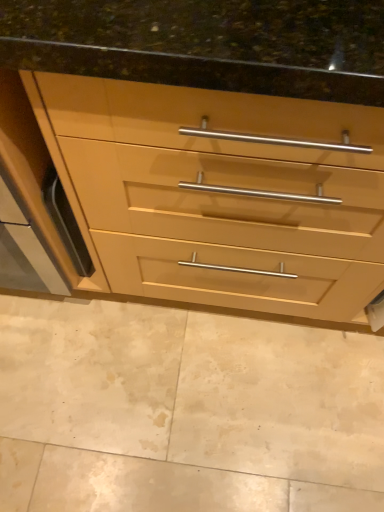
This screenshot has height=512, width=384. Identify the location of matte wood chest of drawers at center. (216, 145).

What do you see at coordinates (216, 145) in the screenshot?
I see `matte wood chest of drawers at center` at bounding box center [216, 145].

Locate an element on the screen. The image size is (384, 512). beige marble floor at lower center is located at coordinates (185, 410).

What do you see at coordinates (185, 410) in the screenshot? I see `beige marble floor at lower center` at bounding box center [185, 410].

Identify the location of matte wood chest of drawers at center. The image size is (384, 512). (216, 145).

Looking at this image, between beige marble floor at lower center and matte wood chest of drawers at center, which one appears on the left side from the viewer's perspective?

From the viewer's perspective, beige marble floor at lower center appears more on the left side.

Is beige marble floor at lower center closer to the viewer compared to matte wood chest of drawers at center?

No.

Is point (17, 426) closer or farther from the camera than point (304, 206)?

Clearly, point (17, 426) is more distant from the camera than point (304, 206).

From the image's perspective, which is above, beige marble floor at lower center or matte wood chest of drawers at center?

matte wood chest of drawers at center, from the image's perspective.

From a real-world perspective, between beige marble floor at lower center and matte wood chest of drawers at center, who is vertically lower?

beige marble floor at lower center is physically lower.

Considering the sizes of objects beige marble floor at lower center and matte wood chest of drawers at center in the image provided, who is thinner, beige marble floor at lower center or matte wood chest of drawers at center?

matte wood chest of drawers at center.

Is beige marble floor at lower center shorter than matte wood chest of drawers at center?

Yes.

Is beige marble floor at lower center smaller than matte wood chest of drawers at center?

Yes.

Is beige marble floor at lower center inside the boundaries of matte wood chest of drawers at center, or outside?

beige marble floor at lower center lies outside matte wood chest of drawers at center.

Is there a large distance between beige marble floor at lower center and matte wood chest of drawers at center?

No, beige marble floor at lower center is in close proximity to matte wood chest of drawers at center.

Is beige marble floor at lower center turned away from matte wood chest of drawers at center?

No, matte wood chest of drawers at center is not at the back of beige marble floor at lower center.

Identify the location of the chest of drawers that appears above the beige marble floor at lower center (from the image's perspective). This screenshot has width=384, height=512. (216, 145).

Based on their positions, is matte wood chest of drawers at center located to the left or right of beige marble floor at lower center?

matte wood chest of drawers at center is to the right of beige marble floor at lower center.

Is matte wood chest of drawers at center behind beige marble floor at lower center?

No, it is not.

Which point is more forward, (134, 260) or (336, 508)?

The point (134, 260) is more forward.

From the image's perspective, which one is positioned higher, matte wood chest of drawers at center or beige marble floor at lower center?

matte wood chest of drawers at center is shown above in the image.

From a real-world perspective, who is located higher, matte wood chest of drawers at center or beige marble floor at lower center?

From a 3D spatial view, matte wood chest of drawers at center is above.

Which of these two, matte wood chest of drawers at center or beige marble floor at lower center, is thinner?

Thinner between the two is matte wood chest of drawers at center.

Between matte wood chest of drawers at center and beige marble floor at lower center, which one has more height?

With more height is matte wood chest of drawers at center.

Who is bigger, matte wood chest of drawers at center or beige marble floor at lower center?

With larger size is matte wood chest of drawers at center.

Can we say matte wood chest of drawers at center lies outside beige marble floor at lower center?

Indeed, matte wood chest of drawers at center is completely outside beige marble floor at lower center.

Is there a large distance between matte wood chest of drawers at center and beige marble floor at lower center?

No, matte wood chest of drawers at center is not far from beige marble floor at lower center.

Is matte wood chest of drawers at center turned away from beige marble floor at lower center?

matte wood chest of drawers at center is not turned away from beige marble floor at lower center.

How many degrees apart are the facing directions of matte wood chest of drawers at center and beige marble floor at lower center?

The facing directions of matte wood chest of drawers at center and beige marble floor at lower center are 89.5 degrees apart.

How far apart are matte wood chest of drawers at center and beige marble floor at lower center?

matte wood chest of drawers at center is 19.79 inches from beige marble floor at lower center.

The width and height of the screenshot is (384, 512). Identify the location of granite behind the matte wood chest of drawers at center. (185, 410).

In the image, there is a matte wood chest of drawers at center. At what (x,y) coordinates should I click in order to perform the action: click on granite below it (from a real-world perspective). Please return your answer as a coordinate pair (x, y). Looking at the image, I should click on (185, 410).

Identify the location of the chest of drawers located above the beige marble floor at lower center (from a real-world perspective). This screenshot has width=384, height=512. (216, 145).